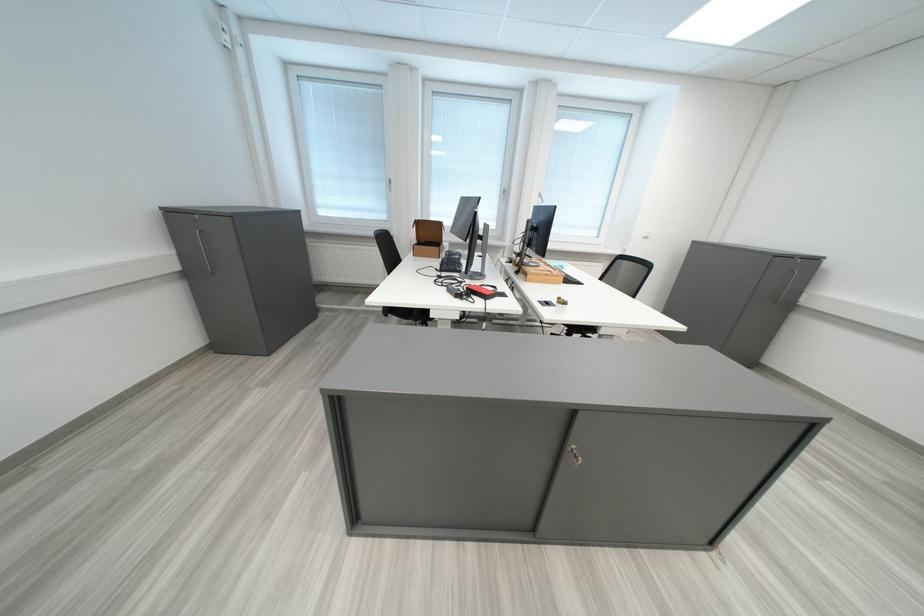
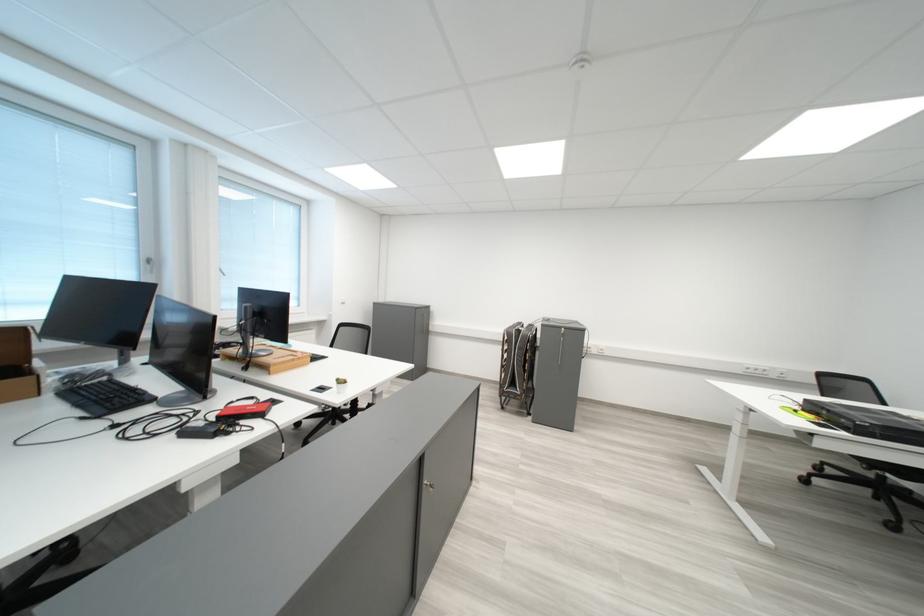
The point at (507,289) is marked in the first image. Where is the corresponding point in the second image?

(264, 400)